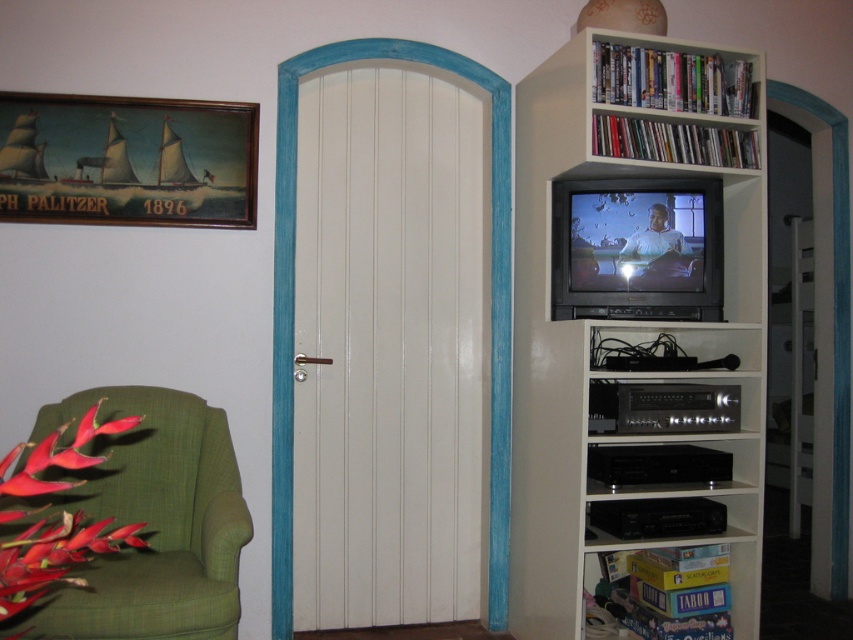
Question: Among these objects, which one is nearest to the camera?

Choices:
 (A) wooden framed painting at upper left
 (B) green fabric armchair at left
 (C) white matte bookcase at upper right
 (D) white wooden shelf at upper right

Answer: (B)

Question: Can you confirm if green fabric armchair at left is positioned to the right of white wooden shelf at upper right?

Choices:
 (A) yes
 (B) no

Answer: (B)

Question: Which point appears closest to the camera in this image?

Choices:
 (A) (91, 163)
 (B) (712, 333)

Answer: (A)

Question: In this image, where is white matte bookcase at upper right located relative to wooden framed painting at upper left?

Choices:
 (A) below
 (B) above

Answer: (A)

Question: Which of the following is the closest to the observer?

Choices:
 (A) wooden framed painting at upper left
 (B) white wooden shelf at upper right
 (C) white matte bookcase at upper right

Answer: (C)

Question: Does green fabric armchair at left appear under wooden framed painting at upper left?

Choices:
 (A) yes
 (B) no

Answer: (A)